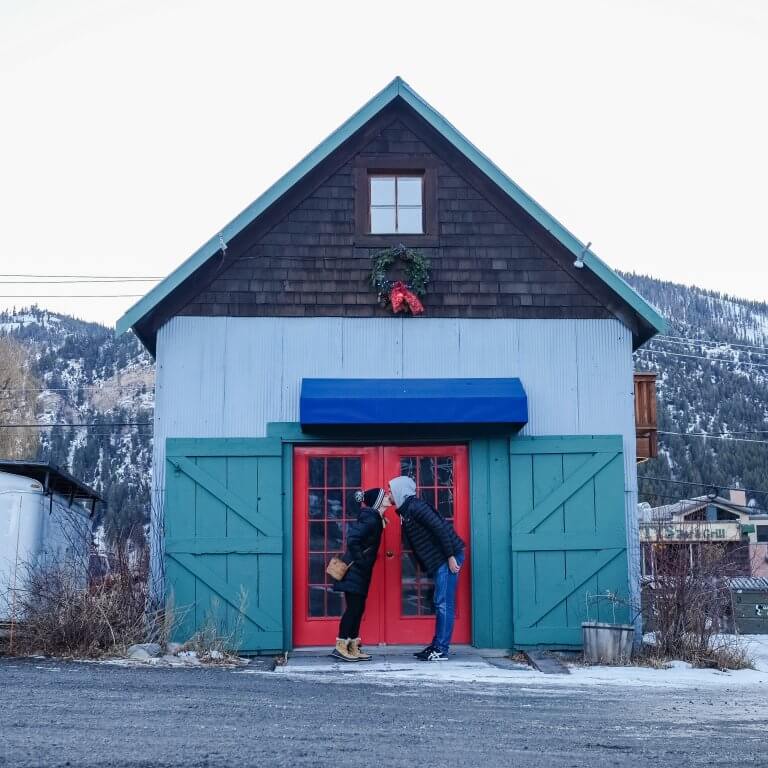
Where is `red doors`? This screenshot has height=768, width=768. red doors is located at coordinates (303, 457), (389, 465).